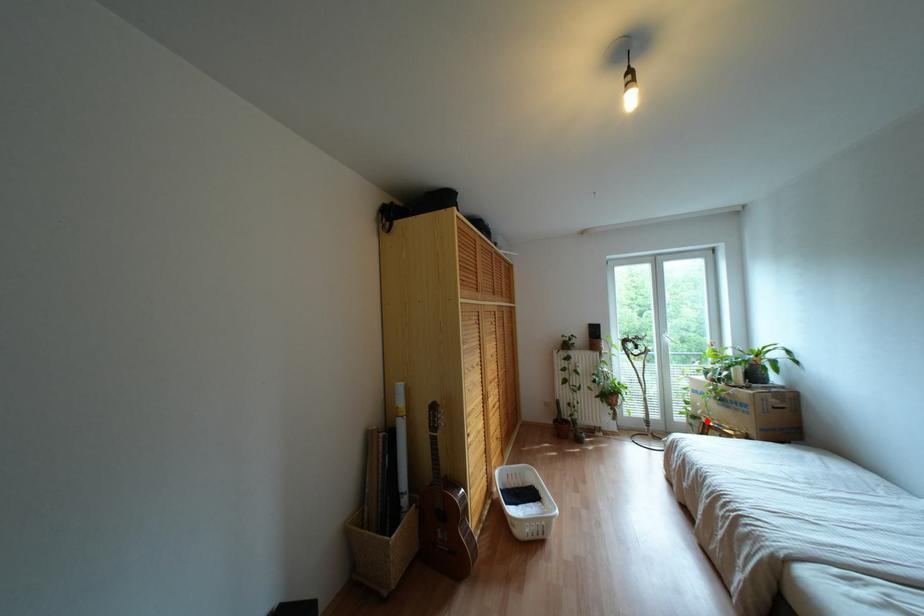
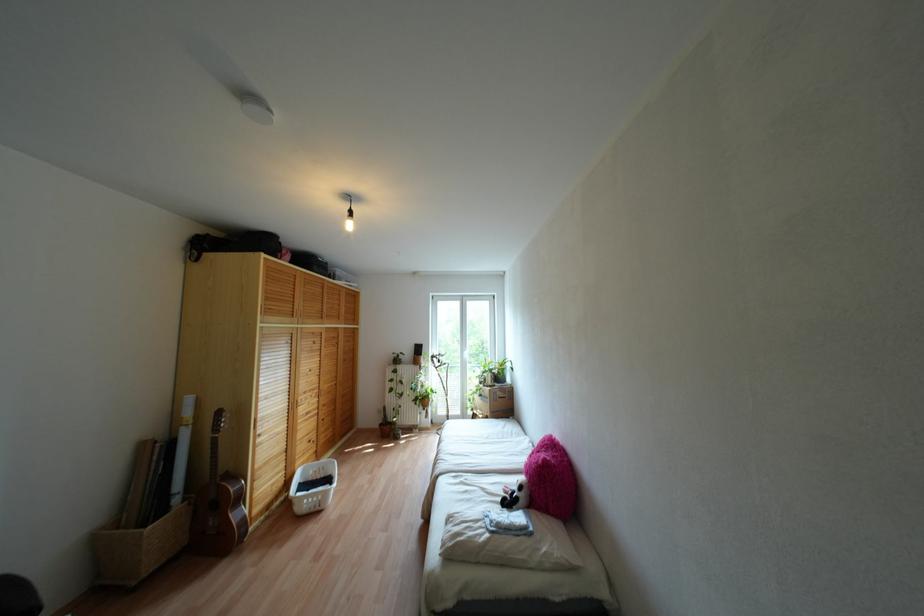
Question: I am providing you with two images of the same scene from different viewpoints. In image1, a red point is highlighted. Considering the same 3D point in image2, which of the following is correct?

Choices:
 (A) It is closer
 (B) It is farther

Answer: (B)